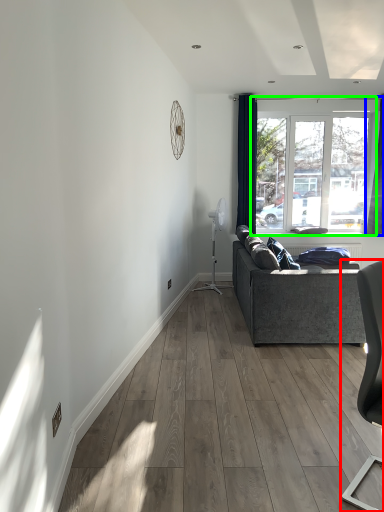
Question: Which is farther away from chair (highlighted by a red box)? curtain (highlighted by a blue box) or window (highlighted by a green box)?

Choices:
 (A) curtain
 (B) window

Answer: (A)